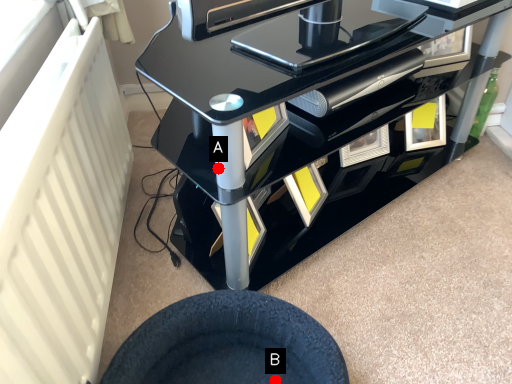
Question: Two points are circled on the image, labeled by A and B beside each circle. Which point is farther to the camera?

Choices:
 (A) A is further
 (B) B is further

Answer: (B)